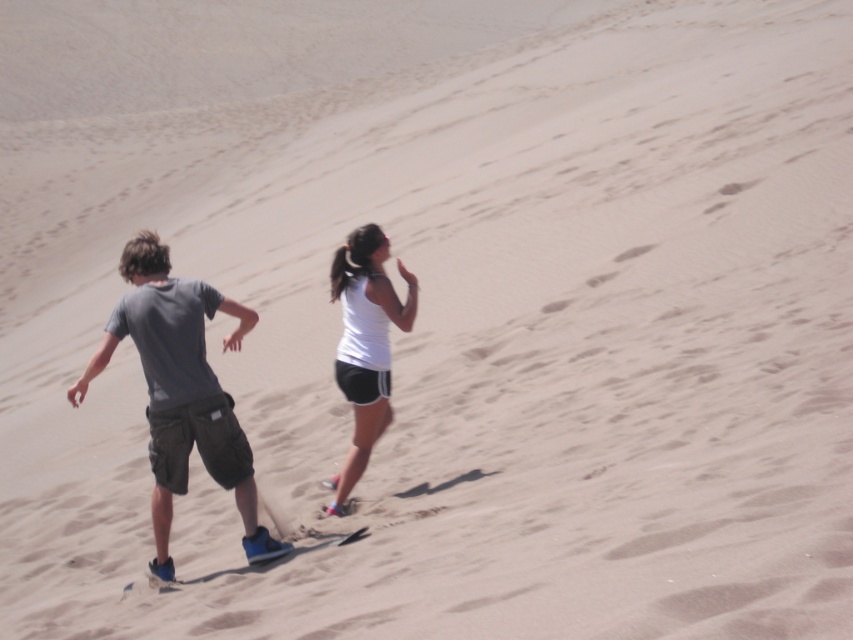
At what (x,y) coordinates should I click in order to perform the action: click on gray cotton t-shirt at left. Please return your answer as a coordinate pair (x, y). Looking at the image, I should click on (181, 390).

What do you see at coordinates (181, 390) in the screenshot?
I see `gray cotton t-shirt at left` at bounding box center [181, 390].

Locate an element on the screen. This screenshot has width=853, height=640. gray cotton t-shirt at left is located at coordinates (181, 390).